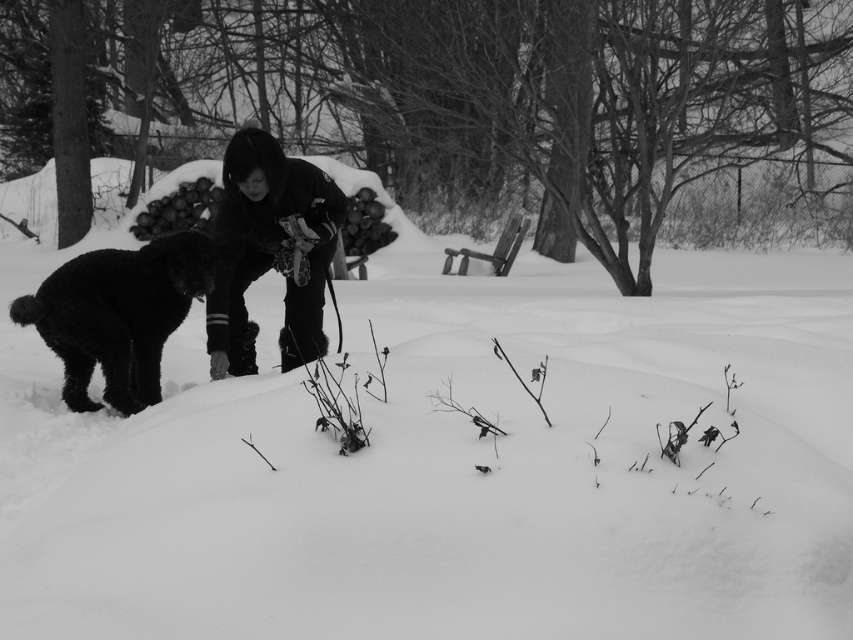
You are standing in the winter scene and want to reach both the point at coordinates point (315, 282) and the point at coordinates point (115, 256). Which point will you reach first as you move forward?

You will reach point (315, 282) first because it is closer to you than point (115, 256).

You are a photographer analyzing this winter scene. You want to place a red dot on the exact center of the image. Is the dark fabric jacket at center located to the left or right of this central point?

The dark fabric jacket at center is located at point 0.392 on the horizontal axis. The exact center of the image would be at 0.5. Since 0.392 is less than 0.5, the dark fabric jacket at center is to the left of the central point.